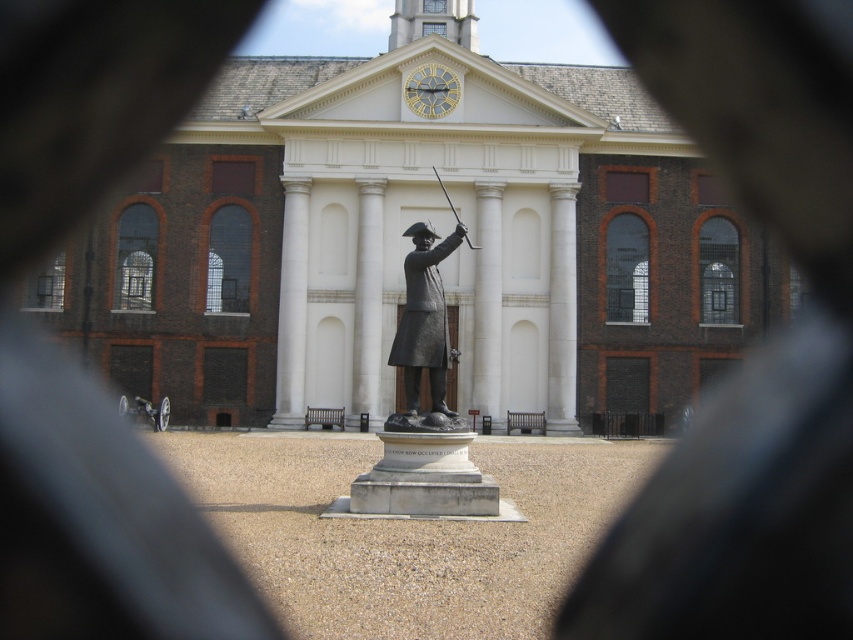
Question: Is white stone church at center smaller than gold/yellow metal clock at upper center?

Choices:
 (A) yes
 (B) no

Answer: (B)

Question: Which object is positioned closest to the gold/yellow metal clock at upper center?

Choices:
 (A) bronze statue at center
 (B) white stone church at center

Answer: (B)

Question: Which point is closer to the camera?

Choices:
 (A) (408, 88)
 (B) (402, 368)

Answer: (B)

Question: Does bronze statue at center have a smaller size compared to gold/yellow metal clock at upper center?

Choices:
 (A) yes
 (B) no

Answer: (B)

Question: Is white stone church at center bigger than bronze statue at center?

Choices:
 (A) yes
 (B) no

Answer: (A)

Question: Which point appears closest to the camera in this image?

Choices:
 (A) (427, 108)
 (B) (320, 355)
 (C) (422, 259)

Answer: (C)